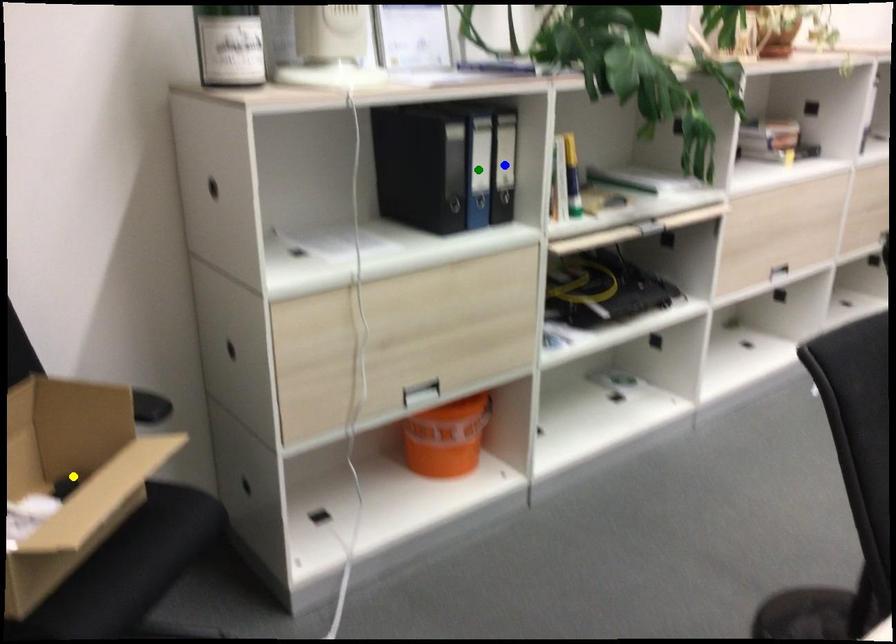
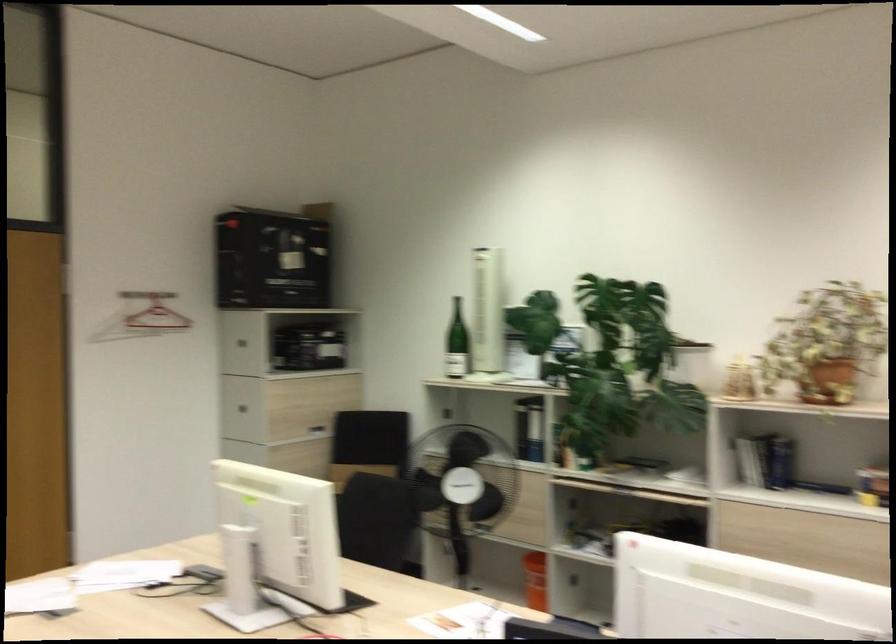
I am providing you with two images of the same scene from different viewpoints. Three points are marked in image1. Which point corresponds to a part or object that is occluded in image2?In image1, three points are marked. Which of them correspond to a part or object that is occluded in image2?Among the three points shown in image1, which one corresponds to a part or object that is no longer visible due to occlusion in image2?

blue point, yellow point, green point cannot be seen in image2.